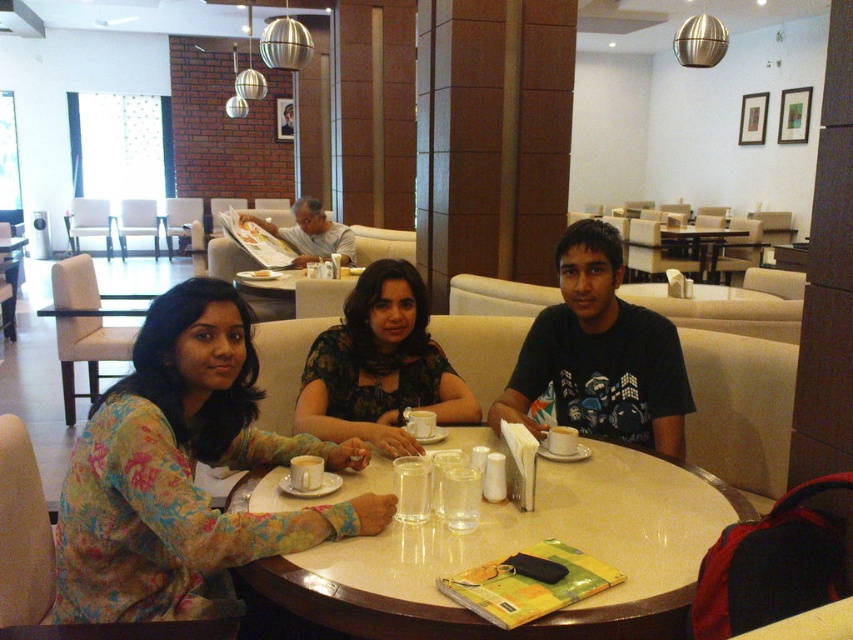
Question: Which of the following is the farthest from the observer?

Choices:
 (A) marble table at center
 (B) floral print dress at center
 (C) floral fabric dress at center

Answer: (C)

Question: Considering the real-world distances, which object is farthest from the matte white shirt at center?

Choices:
 (A) marble table at center
 (B) floral print dress at center

Answer: (A)

Question: In this image, where is floral print dress at center located relative to floral fabric dress at center?

Choices:
 (A) right
 (B) left

Answer: (B)

Question: Is floral print dress at center positioned before matte white shirt at center?

Choices:
 (A) no
 (B) yes

Answer: (B)

Question: Among these points, which one is nearest to the camera?

Choices:
 (A) (701, 480)
 (B) (164, 508)

Answer: (B)

Question: Can you confirm if black cotton t-shirt at center is positioned above smooth wooden table at center?

Choices:
 (A) no
 (B) yes

Answer: (A)